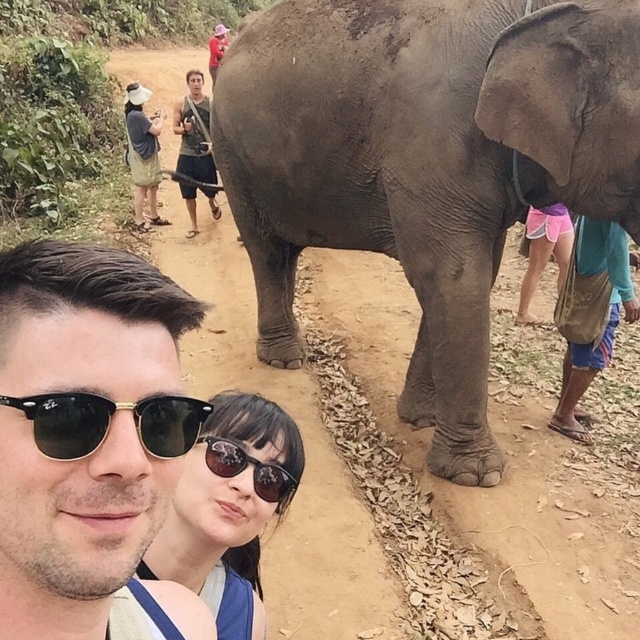
You are a photographer trying to capture a photo of the matte black sunglasses at center and the pink fabric shorts at lower right. Based on their positions, which object is located to the left of the other?

The matte black sunglasses at center is positioned on the left side of pink fabric shorts at lower right.

You are a photographer trying to capture a clear shot of the matte black sunglasses at center and the pink fabric shorts at lower right. Based on their positions, which object should you focus on first to ensure both are in focus?

The matte black sunglasses at center is below the pink fabric shorts at lower right, so you should focus on the pink fabric shorts at lower right first since it is closer to the camera. This way, the matte black sunglasses at center, being further away, will also be in focus if the depth of field is sufficient.